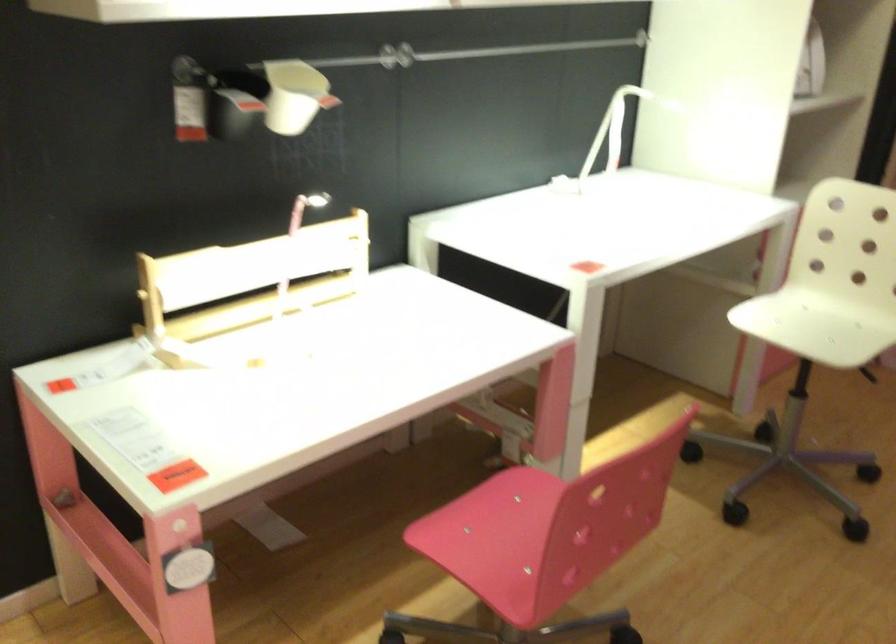
What do you see at coordinates (479, 535) in the screenshot? I see `the pink chair sitting surface` at bounding box center [479, 535].